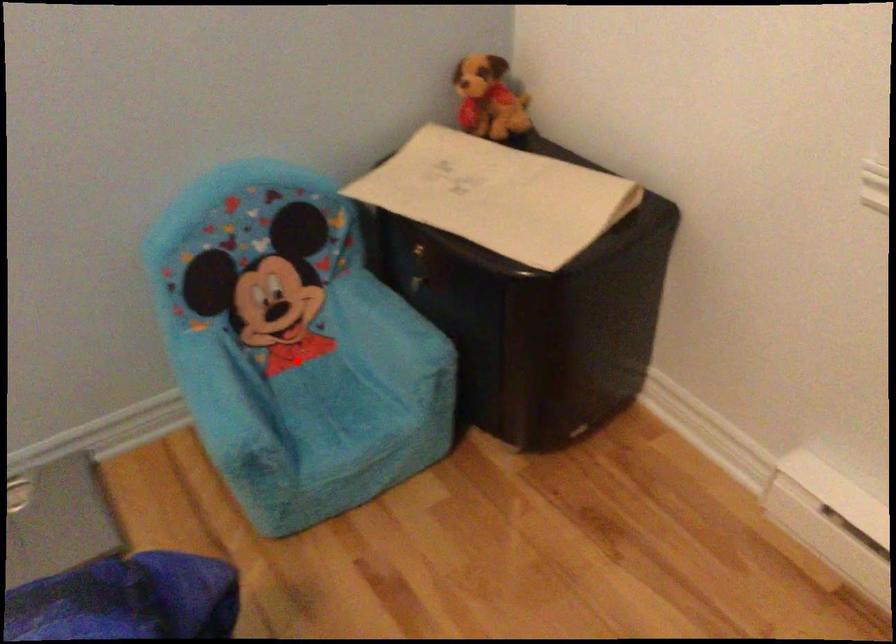
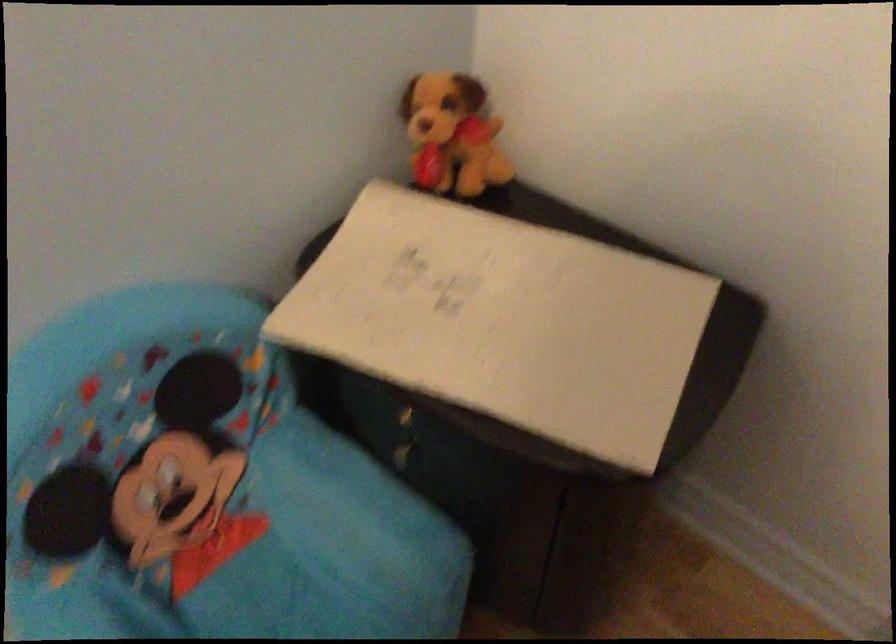
Question: I am providing you with two images of the same scene from different viewpoints. Image1 has a red point marked. In image2, the corresponding 3D location appears at what relative position? Reply with the corresponding letter.

Choices:
 (A) Closer
 (B) Farther

Answer: (A)